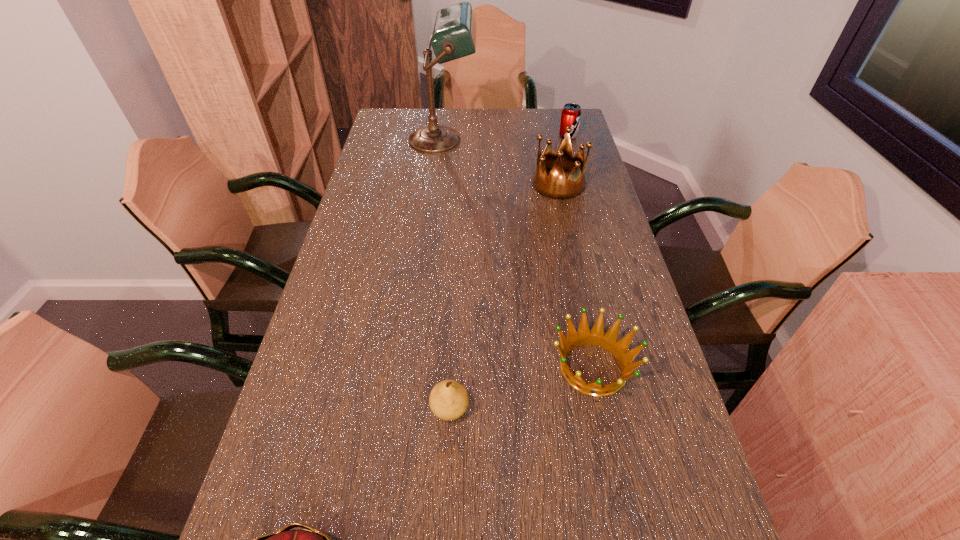
Image resolution: width=960 pixels, height=540 pixels. I want to click on vacant area that lies between the pear and the farthest crown, so click(x=504, y=296).

Where is `unoccupied position between the second tallest object and the tallest object`? This screenshot has width=960, height=540. unoccupied position between the second tallest object and the tallest object is located at coordinates (500, 162).

Find the location of a particular element. Image resolution: width=960 pixels, height=540 pixels. free spot between the table lamp and the pear is located at coordinates (446, 274).

The image size is (960, 540). Identify the location of vacant space that's between the fourth nearest object and the pear. (504, 296).

The width and height of the screenshot is (960, 540). In order to click on vacant area between the tallest object and the pear in this screenshot , I will do `click(446, 274)`.

This screenshot has height=540, width=960. Identify the location of object that is the fourth closest one to the tallest object. (448, 400).

Find the location of a particular element. object that is the fifth closest to the soda can is located at coordinates (285, 539).

Choose which crown is the nearest neighbor to the leftmost crown. Please provide its 2D coordinates. Your answer should be formatted as a tuple, i.e. [(x, y)], where the tuple contains the x and y coordinates of a point satisfying the conditions above.

[(596, 337)]

Identify which crown is the closest to the second nearest crown. Please provide its 2D coordinates. Your answer should be formatted as a tuple, i.e. [(x, y)], where the tuple contains the x and y coordinates of a point satisfying the conditions above.

[(285, 539)]

Find the location of a particular element. The height and width of the screenshot is (540, 960). vacant space that satisfies the following two spatial constraints: 1. above the green lampshade of the tallest object; 2. on the left side of the tallest crown is located at coordinates [438, 184].